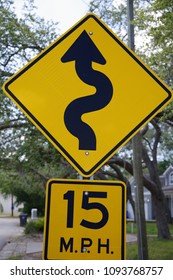
At what (x,y) coordinates should I click in order to perform the action: click on dark trash can. Please return your answer as a coordinate pair (x, y). Looking at the image, I should click on (25, 219).